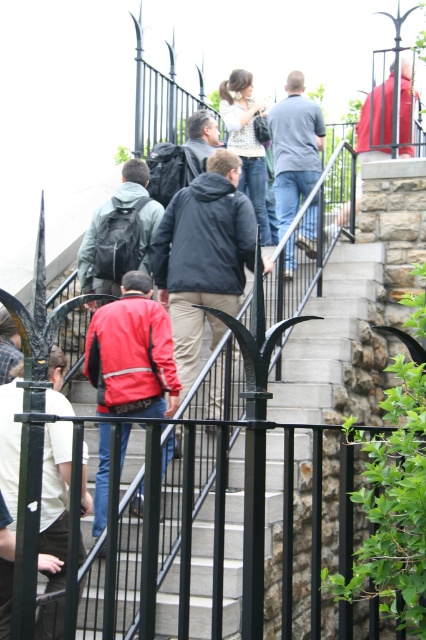
Question: Among these points, which one is farthest from the camera?

Choices:
 (A) (6, 326)
 (B) (207, 156)

Answer: (B)

Question: Can you confirm if red matte jacket at upper center is smaller than red jacket at upper center?

Choices:
 (A) no
 (B) yes

Answer: (A)

Question: Which is farther from the red matte jacket at upper center?

Choices:
 (A) red leather jacket at center
 (B) dark blue jacket at center

Answer: (A)

Question: Which of the following is the closest to the observer?

Choices:
 (A) red leather jacket at center
 (B) dark blue jacket at center
 (C) red matte jacket at upper center

Answer: (A)

Question: Can you confirm if gray cotton shirt at upper center is positioned above patterned blouse at center?

Choices:
 (A) no
 (B) yes

Answer: (A)

Question: Can you confirm if gray cotton shirt at upper center is bigger than patterned blouse at center?

Choices:
 (A) no
 (B) yes

Answer: (B)